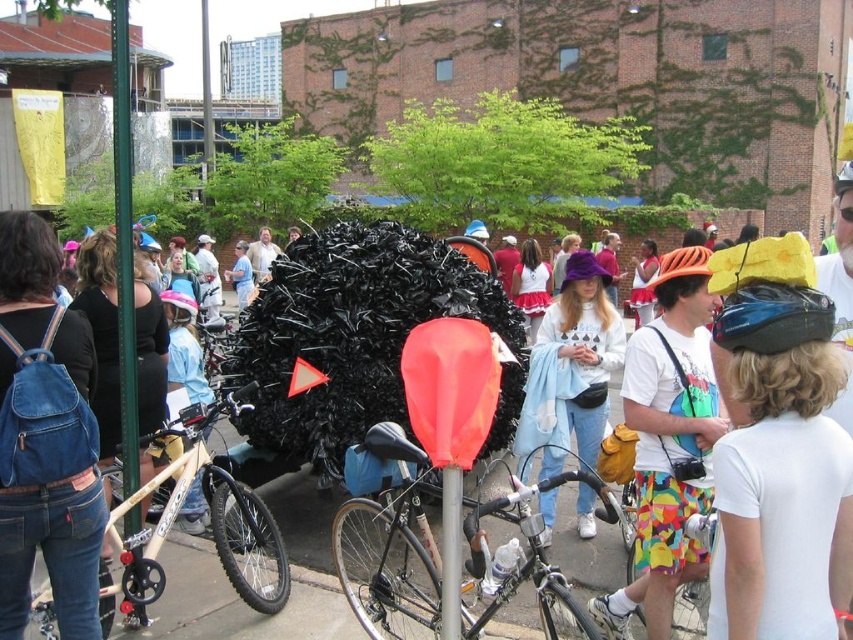
Question: Can you confirm if multicolored fabric shorts at center is positioned to the right of denim backpack at left?

Choices:
 (A) yes
 (B) no

Answer: (A)

Question: Can you confirm if denim backpack at left is bigger than wooden frame bicycle at left?

Choices:
 (A) yes
 (B) no

Answer: (A)

Question: Based on their relative distances, which object is nearer to the wooden frame bicycle at left?

Choices:
 (A) blue matte helmet at upper right
 (B) black matte bicycle at center

Answer: (B)

Question: Which of the following is the farthest from the observer?

Choices:
 (A) light blue denim jeans at center
 (B) multicolored fabric shorts at center
 (C) wooden frame bicycle at left

Answer: (A)

Question: Is blue matte helmet at upper right to the left of shiny black bicycle at center from the viewer's perspective?

Choices:
 (A) yes
 (B) no

Answer: (B)

Question: Which point is farther to the camera?

Choices:
 (A) (566, 305)
 (B) (140, 568)
 (C) (9, 522)

Answer: (A)